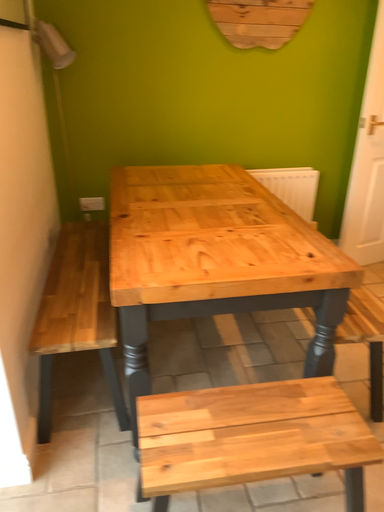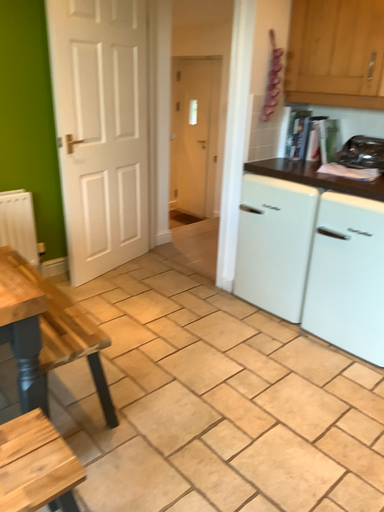
Question: Which way did the camera rotate in the video?

Choices:
 (A) rotated left
 (B) rotated right

Answer: (B)